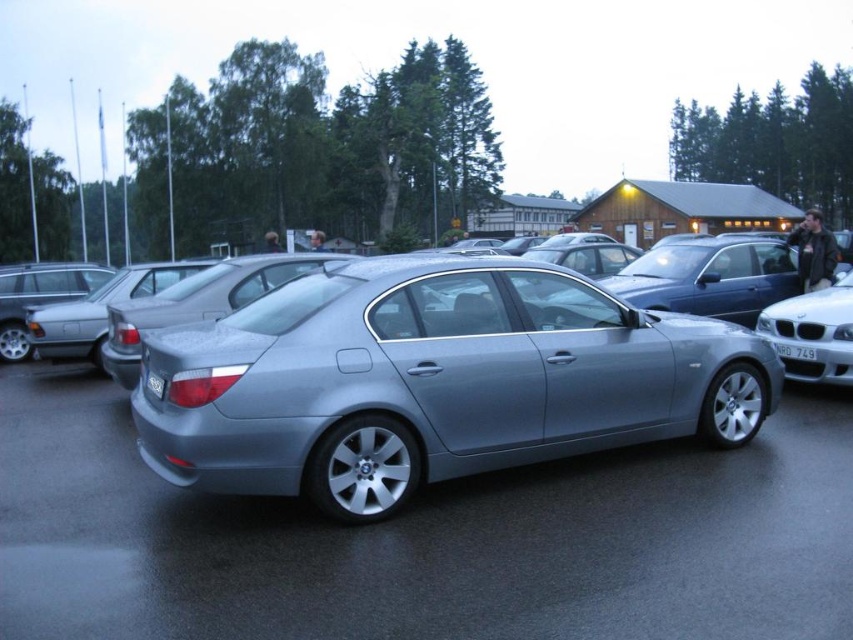
Question: Is satin metallic sedan at center wider than black plastic license plate at center?

Choices:
 (A) yes
 (B) no

Answer: (A)

Question: Which object is closer to the camera taking this photo?

Choices:
 (A) white plastic license plate at center
 (B) satin white car at right
 (C) satin metallic sedan at center
 (D) black plastic license plate at center

Answer: (C)

Question: Among these points, which one is nearest to the camera?

Choices:
 (A) (158, 378)
 (B) (811, 353)
 (C) (838, 356)
 (D) (294, 346)

Answer: (D)

Question: Can you confirm if satin metallic sedan at center is thinner than white plastic license plate at center?

Choices:
 (A) yes
 (B) no

Answer: (B)

Question: Which of the following is the closest to the observer?

Choices:
 (A) (311, 346)
 (B) (837, 328)

Answer: (A)

Question: From the image, what is the correct spatial relationship of satin metallic sedan at center in relation to black plastic license plate at center?

Choices:
 (A) left
 (B) right

Answer: (B)